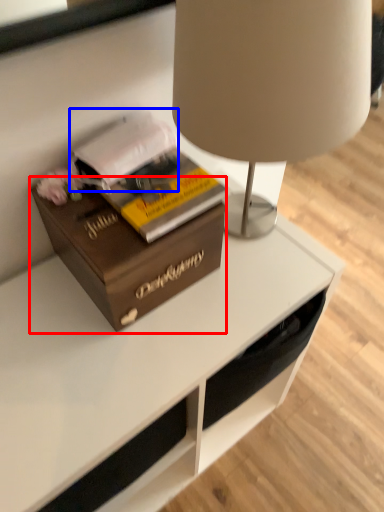
Question: Among these objects, which one is nearest to the camera, box (highlighted by a red box) or book (highlighted by a blue box)?

Choices:
 (A) box
 (B) book

Answer: (A)